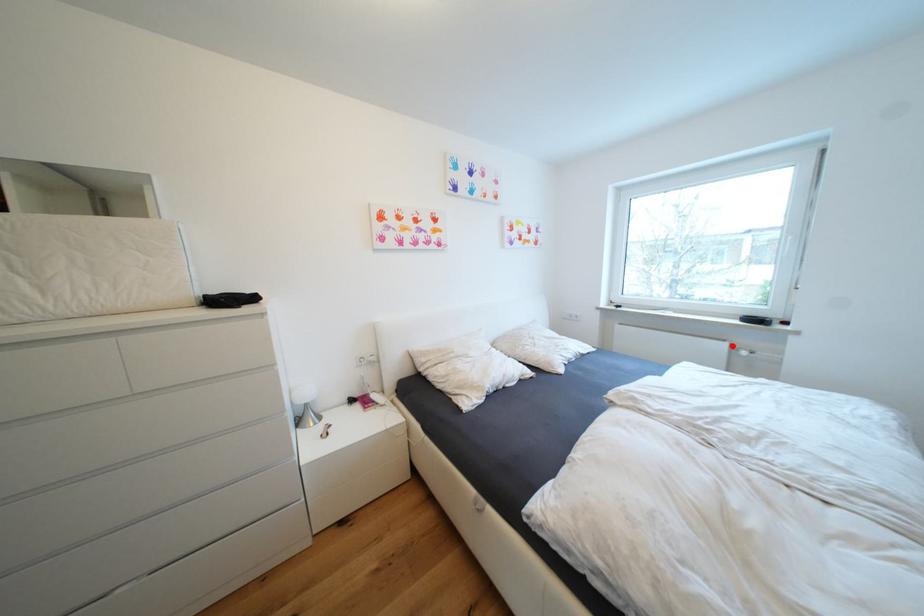
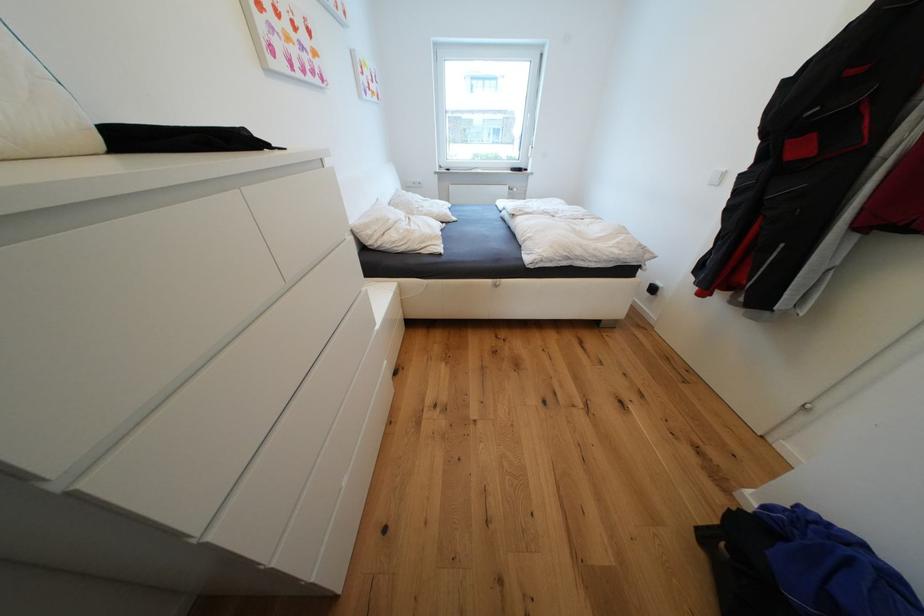
Where in the second image is the point corresponding to the highlighted location from the first image?

(515, 188)